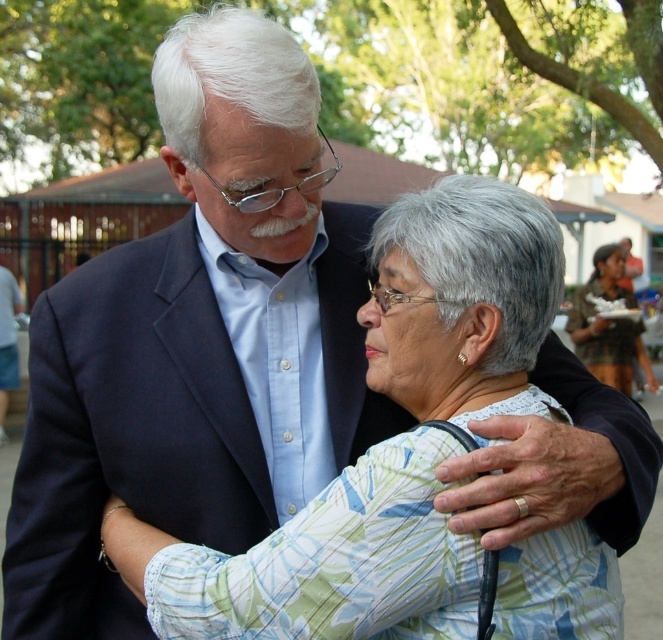
Question: Which point is farther to the camera?

Choices:
 (A) matte blue suit at center
 (B) camouflage fabric shirt at right

Answer: (A)

Question: Which point is closer to the camera?

Choices:
 (A) camouflage fabric shirt at right
 (B) matte blue suit at center

Answer: (A)

Question: Is camouflage fabric shirt at right in front of matte blue suit at center?

Choices:
 (A) yes
 (B) no

Answer: (A)

Question: Which of the following is the farthest from the observer?

Choices:
 (A) (587, 364)
 (B) (5, 358)

Answer: (B)

Question: Is camouflage fabric shirt at right thinner than matte blue suit at center?

Choices:
 (A) yes
 (B) no

Answer: (B)

Question: Does camouflage fabric shirt at right lie behind matte blue suit at center?

Choices:
 (A) no
 (B) yes

Answer: (A)